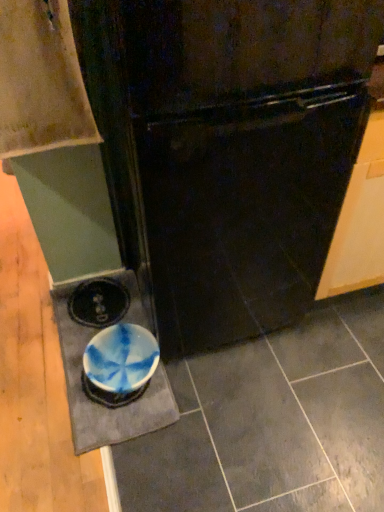
The image size is (384, 512). Describe the element at coordinates (41, 80) in the screenshot. I see `wooden cabinet at upper left` at that location.

The image size is (384, 512). Find the location of `wooden cabinet at upper left`. wooden cabinet at upper left is located at coordinates (41, 80).

What do you see at coordinates (229, 150) in the screenshot?
I see `black glossy refrigerator at center` at bounding box center [229, 150].

Locate an element on the screen. The image size is (384, 512). black glossy refrigerator at center is located at coordinates (229, 150).

This screenshot has width=384, height=512. Identify the location of wooden cabinet at upper left. (41, 80).

Which is more to the left, black glossy refrigerator at center or wooden cabinet at upper left?

Positioned to the left is wooden cabinet at upper left.

Considering the relative positions of black glossy refrigerator at center and wooden cabinet at upper left in the image provided, is black glossy refrigerator at center in front of wooden cabinet at upper left?

Yes.

Considering the positions of point (263, 298) and point (11, 8), is point (263, 298) closer or farther from the camera than point (11, 8)?

Point (263, 298).

From the image's perspective, is black glossy refrigerator at center positioned above or below wooden cabinet at upper left?

From the image's perspective, black glossy refrigerator at center appears below wooden cabinet at upper left.

From a real-world perspective, does black glossy refrigerator at center stand above wooden cabinet at upper left?

No.

Which object is thinner, black glossy refrigerator at center or wooden cabinet at upper left?

wooden cabinet at upper left is thinner.

Is black glossy refrigerator at center taller than wooden cabinet at upper left?

Yes.

Considering the sizes of objects black glossy refrigerator at center and wooden cabinet at upper left in the image provided, who is bigger, black glossy refrigerator at center or wooden cabinet at upper left?

Bigger between the two is black glossy refrigerator at center.

Is black glossy refrigerator at center situated inside wooden cabinet at upper left or outside?

black glossy refrigerator at center lies outside wooden cabinet at upper left.

Is black glossy refrigerator at center in contact with wooden cabinet at upper left?

No, black glossy refrigerator at center is not making contact with wooden cabinet at upper left.

Is black glossy refrigerator at center positioned with its back to wooden cabinet at upper left?

That's not correct — black glossy refrigerator at center is not looking away from wooden cabinet at upper left.

Identify the location of cabinetry on the left of the black glossy refrigerator at center. The image size is (384, 512). (41, 80).

Considering the relative positions of wooden cabinet at upper left and black glossy refrigerator at center in the image provided, is wooden cabinet at upper left to the left of black glossy refrigerator at center from the viewer's perspective?

Indeed, wooden cabinet at upper left is positioned on the left side of black glossy refrigerator at center.

Is wooden cabinet at upper left in front of black glossy refrigerator at center?

No, it is behind black glossy refrigerator at center.

Which is farther, (24, 97) or (337, 5)?

The point (24, 97) is behind.

From the image's perspective, is wooden cabinet at upper left beneath black glossy refrigerator at center?

Incorrect, from the image's perspective, wooden cabinet at upper left is higher than black glossy refrigerator at center.

From a real-world perspective, is wooden cabinet at upper left above or below black glossy refrigerator at center?

wooden cabinet at upper left is situated higher than black glossy refrigerator at center in the real world.

Which object is wider, wooden cabinet at upper left or black glossy refrigerator at center?

Wider between the two is black glossy refrigerator at center.

In terms of height, does wooden cabinet at upper left look taller or shorter compared to black glossy refrigerator at center?

Clearly, wooden cabinet at upper left is shorter compared to black glossy refrigerator at center.

Considering the sizes of objects wooden cabinet at upper left and black glossy refrigerator at center in the image provided, who is bigger, wooden cabinet at upper left or black glossy refrigerator at center?

Bigger between the two is black glossy refrigerator at center.

In the scene shown: Is wooden cabinet at upper left located outside black glossy refrigerator at center?

Yes.

Is wooden cabinet at upper left with black glossy refrigerator at center?

No, wooden cabinet at upper left is not with black glossy refrigerator at center.

Could you tell me if wooden cabinet at upper left is turned towards black glossy refrigerator at center?

No, wooden cabinet at upper left is not turned towards black glossy refrigerator at center.

In the image, there is a black glossy refrigerator at center. In order to click on cabinetry above it (from the image's perspective) in this screenshot , I will do `click(41, 80)`.

Where is `refrigerator below the wooden cabinet at upper left (from a real-world perspective)`? This screenshot has width=384, height=512. refrigerator below the wooden cabinet at upper left (from a real-world perspective) is located at coordinates (229, 150).

Find the location of a particular element. cabinetry above the black glossy refrigerator at center (from a real-world perspective) is located at coordinates (41, 80).